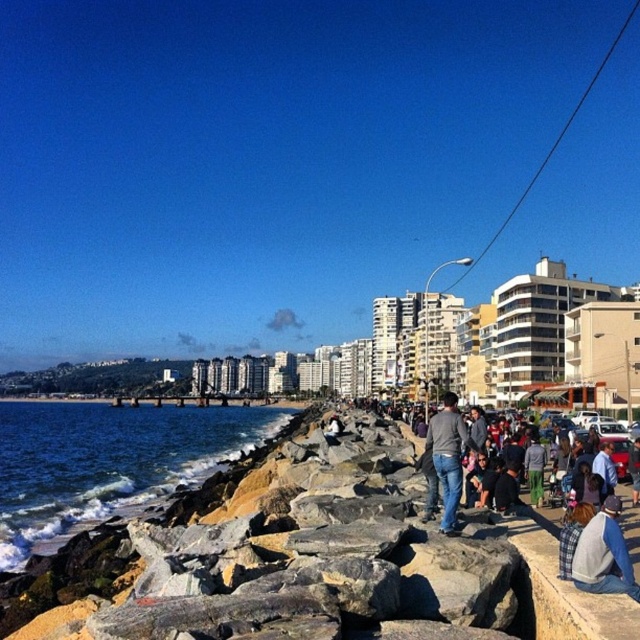
You are a photographer setting up a tripod in this coastal scene. You need to place your equipment between the plaid fabric jacket at lower right and the jeans at center. Based on their heights, which object should you avoid placing taller items near to ensure stability?

The plaid fabric jacket at lower right is not as tall as the jeans at center, so you should avoid placing taller items near the plaid fabric jacket at lower right to maintain stability.

You are standing at the edge of the rocky jetty and want to take a photo of the two points marked in the scene. Which point, point (x=589, y=570) or point (x=442, y=456), will appear larger in your camera view?

Point (x=589, y=570) will appear larger in your camera view because it is closer to the camera than point (x=442, y=456).

You are standing at the edge of the jetty and see the blue smooth water at lower left and the jeans at center. Which object is closer to your left side?

The blue smooth water at lower left is positioned on the left side of jeans at center, so it is closer to your left side.